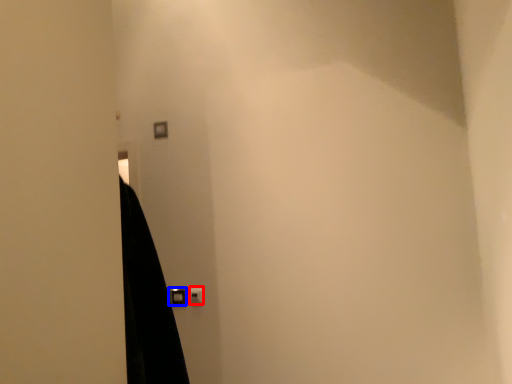
Question: Which object is closer to the camera taking this photo, light switch (highlighted by a red box) or door handle (highlighted by a blue box)?

Choices:
 (A) light switch
 (B) door handle

Answer: (A)